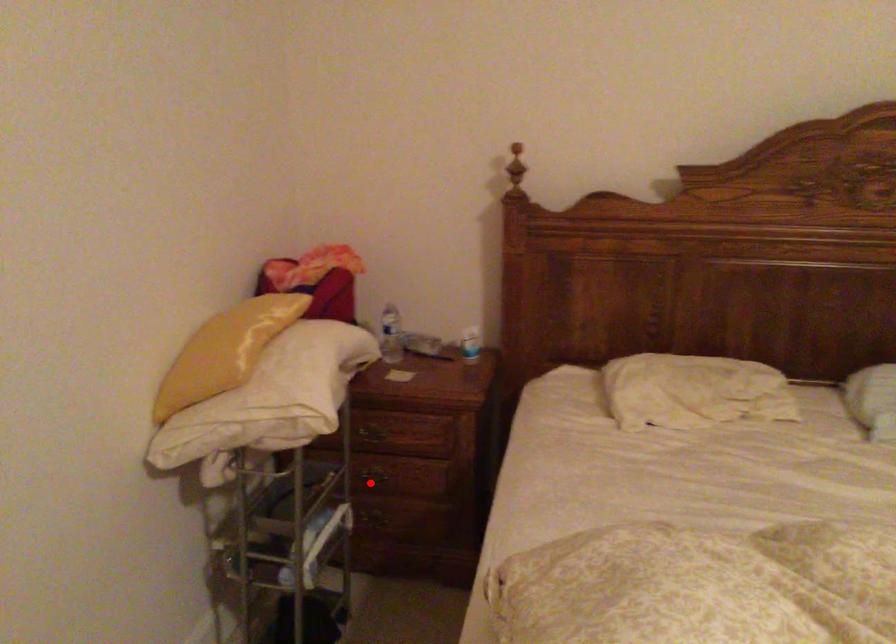
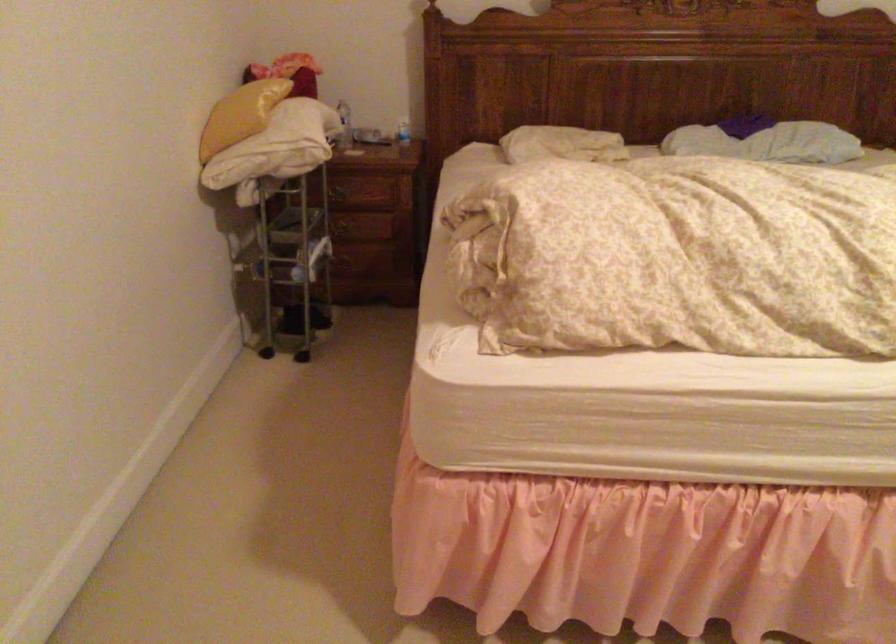
The point at the highlighted location is marked in the first image. Where is the corresponding point in the second image?

(342, 230)